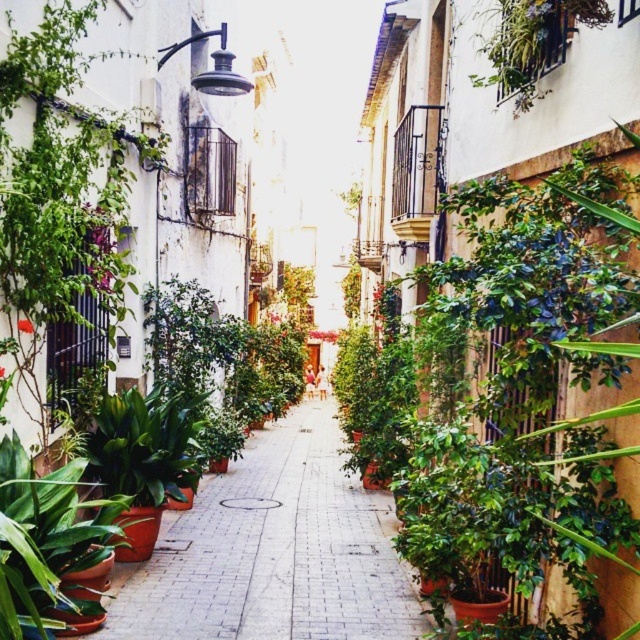
Measure the distance between brick pavement at center and camera.

They are 18.26 feet apart.

This screenshot has height=640, width=640. What do you see at coordinates (273, 552) in the screenshot?
I see `brick pavement at center` at bounding box center [273, 552].

The height and width of the screenshot is (640, 640). I want to click on brick pavement at center, so click(x=273, y=552).

You are a GUI agent. You are given a task and a screenshot of the screen. Output one action in this format:
    pyautogui.click(x=<x>, y=<y>)
    Task: Click on the brick pavement at center
    
    Given the screenshot: What is the action you would take?
    pyautogui.click(x=273, y=552)